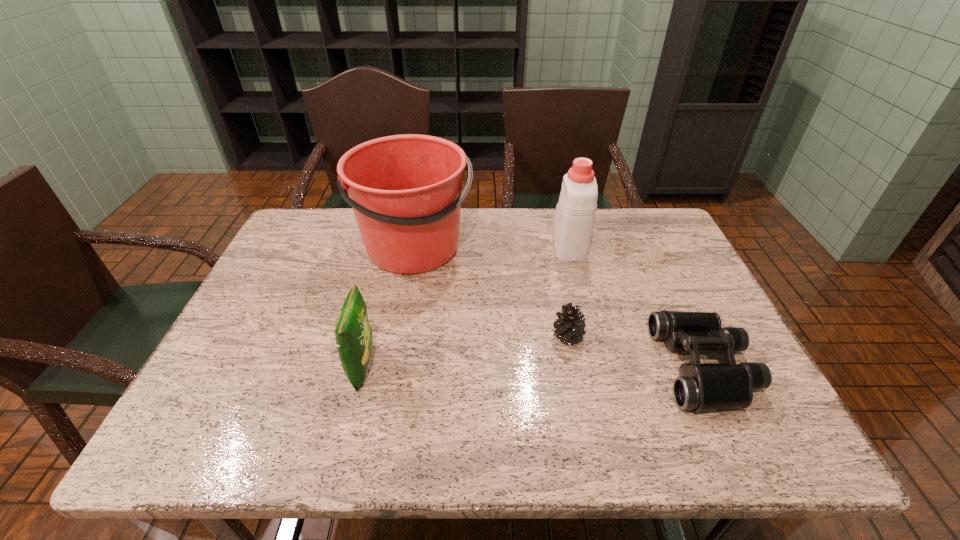
Where is `vacant space that is in between the detergent and the third tallest object`? vacant space that is in between the detergent and the third tallest object is located at coordinates (466, 305).

Find the location of a particular element. The height and width of the screenshot is (540, 960). vacant space in between the detergent and the bucket is located at coordinates tap(492, 245).

You are a GUI agent. You are given a task and a screenshot of the screen. Output one action in this format:
    pyautogui.click(x=<x>, y=<y>)
    Task: Click on the free space between the binoculars and the crisp (potato chip)
    This screenshot has height=540, width=960.
    Given the screenshot: What is the action you would take?
    pyautogui.click(x=534, y=367)

Where is `unoccupied position between the rightmost object and the bucket`? This screenshot has width=960, height=540. unoccupied position between the rightmost object and the bucket is located at coordinates (560, 307).

Locate an element on the screen. This screenshot has width=960, height=540. free space between the pinecone and the bucket is located at coordinates (492, 292).

Locate an element on the screen. This screenshot has width=960, height=540. the closest object to the rightmost object is located at coordinates (570, 324).

Point out which object is positioned as the third nearest to the bucket. Please provide its 2D coordinates. Your answer should be formatted as a tuple, i.e. [(x, y)], where the tuple contains the x and y coordinates of a point satisfying the conditions above.

[(574, 217)]